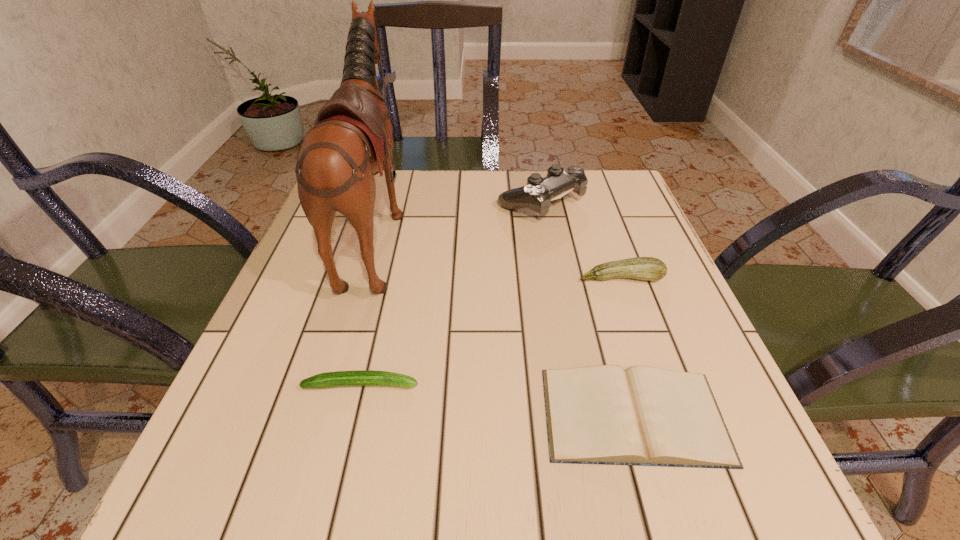
Select which object is the third closest to the Bible. Please provide its 2D coordinates. Your answer should be formatted as a tuple, i.e. [(x, y)], where the tuple contains the x and y coordinates of a point satisfying the conditions above.

[(352, 140)]

I want to click on vacant space that satisfies the following two spatial constraints: 1. on the back of the Bible; 2. on the right side of the saddle, so click(324, 415).

Identify the location of free space that satisfies the following two spatial constraints: 1. on the back of the tallest object; 2. on the right side of the Bible. (324, 415).

Identify the location of free region that satisfies the following two spatial constraints: 1. on the back of the tallest object; 2. on the left side of the Bible. (324, 415).